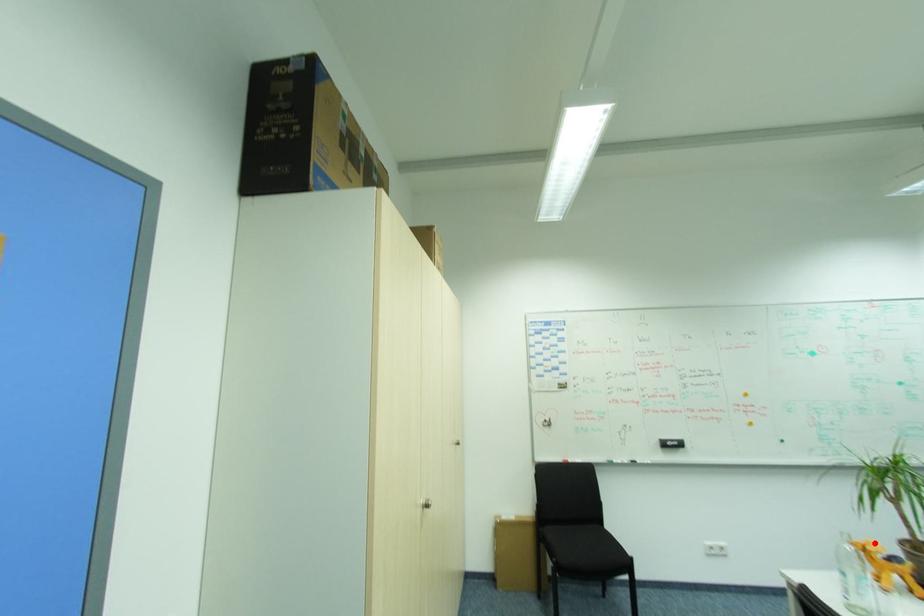
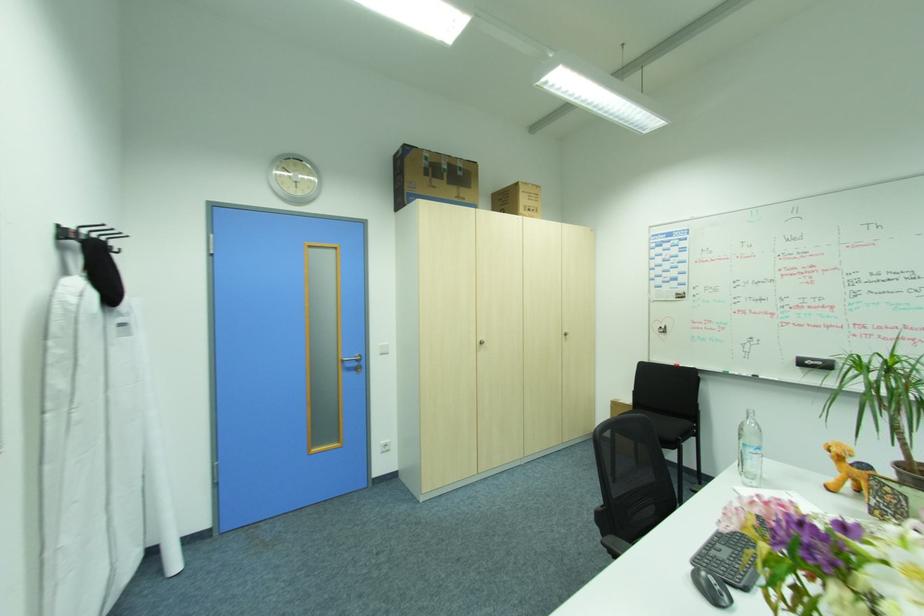
Locate, in the second image, the point that corresponds to the highlighted location in the first image.

(844, 446)